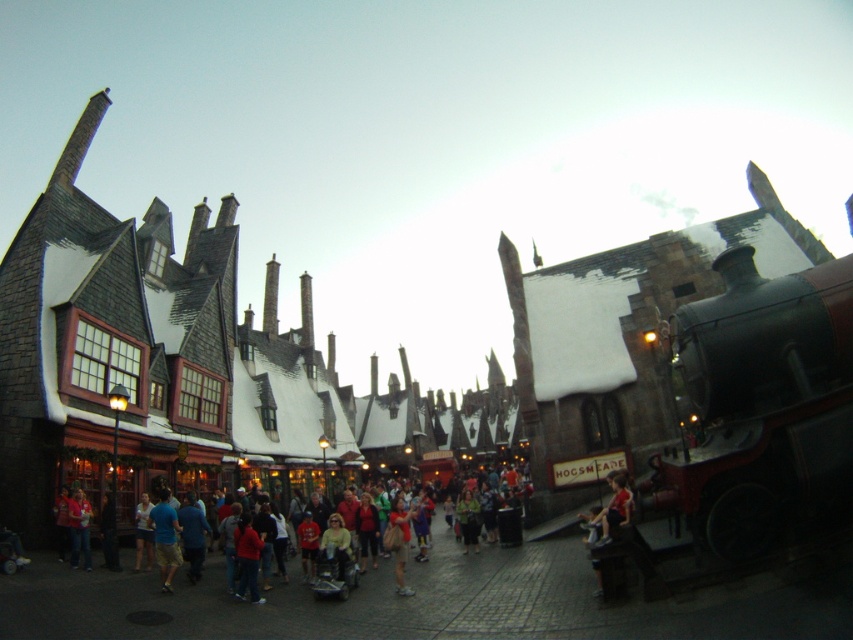
Between blue cotton shorts at center and matte beige shirt at center, which one is positioned higher?

Positioned higher is blue cotton shorts at center.

Does blue cotton shorts at center have a larger size compared to matte beige shirt at center?

Incorrect, blue cotton shorts at center is not larger than matte beige shirt at center.

Is point (160, 561) positioned behind point (415, 512)?

That is False.

Locate an element on the screen. blue cotton shorts at center is located at coordinates (165, 538).